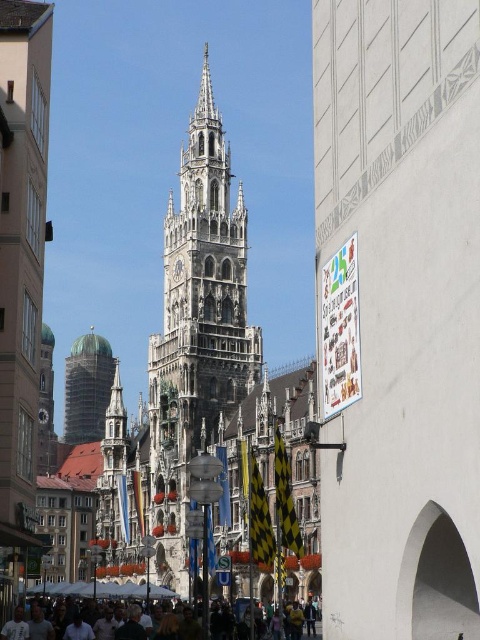
Based on the photo, you are standing in the middle of the street looking at the stone gothic tower at center and the dark gray concrete crowd at lower center. Which object is closer to you?

The dark gray concrete crowd at lower center is closer to you because it is in front of the stone gothic tower at center.

You are a drone operator who needs to fly a drone between the stone gothic tower at center and the green copper dome at center. The drone has a maximum flight range of 25 meters. Can the drone safely fly between them without exceeding its range?

The stone gothic tower at center is 24.11 meters from the green copper dome at center. Since the drone has a maximum flight range of 25 meters, it can safely fly between them as the distance is within the drone operator range.